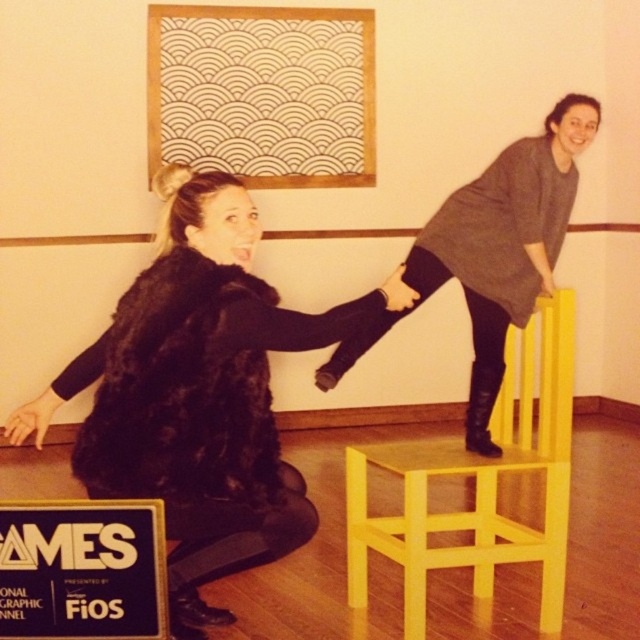
In the scene shown: You are standing at the origin point of the coordinate system in the image. The yellow matte chair at upper right is located at coordinate point (477, 483). If you want to walk towards the yellow matte chair at upper right, which direction should you move in terms of the coordinate system?

To reach the yellow matte chair at upper right located at point (477, 483), you should move in the positive x and positive y direction since both coordinates are greater than 0.5, indicating the right and upper part of the image.